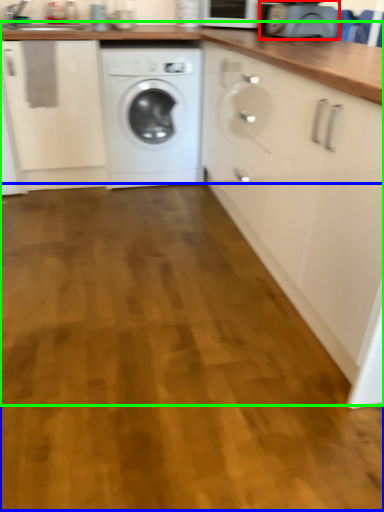
Question: Which object is the closest to the appliance (highlighted by a red box)? Choose among these: plain (highlighted by a blue box) or counter (highlighted by a green box).

Choices:
 (A) plain
 (B) counter

Answer: (B)